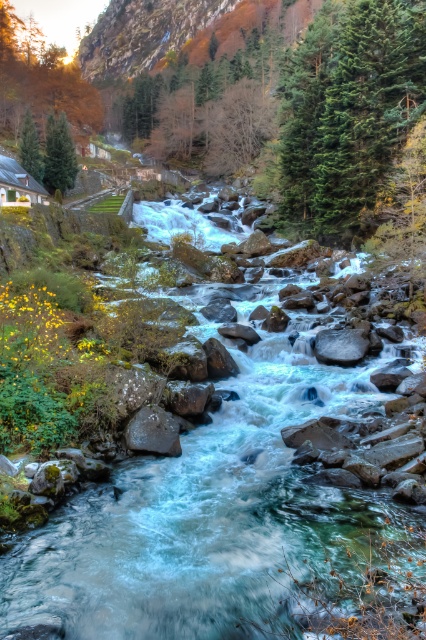
Which is more to the left, clear water at center or smooth gray rock at center?

smooth gray rock at center is more to the left.

Describe the element at coordinates (201, 467) in the screenshot. The image size is (426, 640). I see `clear water at center` at that location.

Where is `clear water at center`? The image size is (426, 640). clear water at center is located at coordinates (201, 467).